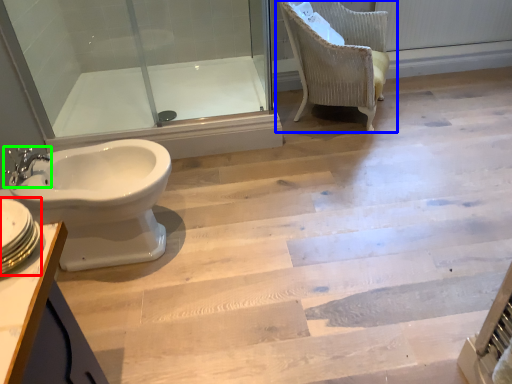
Question: Estimate the real-world distances between objects in this image. Which object is closer to sink (highlighted by a red box), chair (highlighted by a blue box) or tap (highlighted by a green box)?

Choices:
 (A) chair
 (B) tap

Answer: (B)